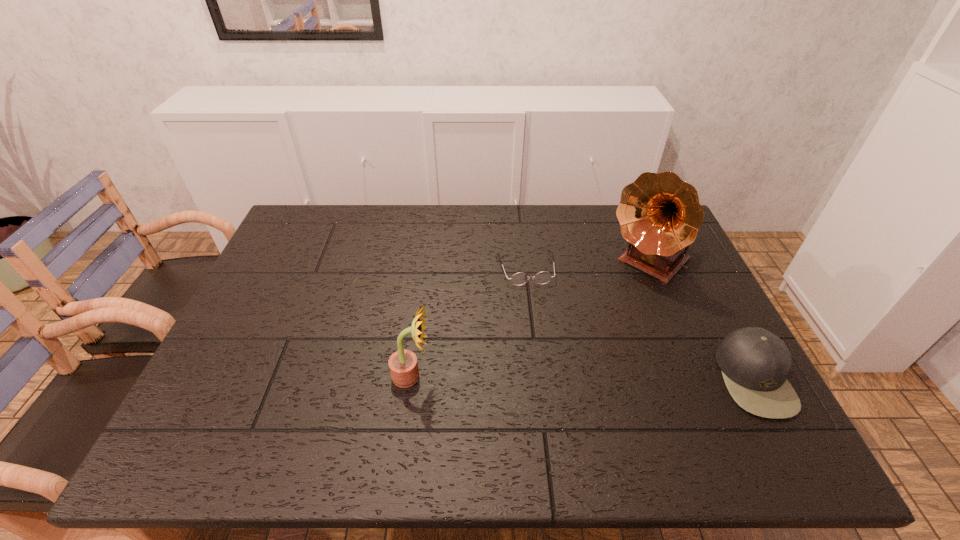
I want to click on free space located on the horn of the phonograph_record, so click(569, 345).

Find the location of a particular element. The image size is (960, 540). vacant space positioned 0.370m on the horn of the phonograph_record is located at coordinates (551, 363).

I want to click on vacant space located 0.300m on the horn of the phonograph_record, so click(567, 347).

Where is `free region located through the lenses of the spectacles`? This screenshot has height=540, width=960. free region located through the lenses of the spectacles is located at coordinates (544, 353).

Locate an element on the screen. free space located 0.240m through the lenses of the spectacles is located at coordinates (544, 353).

Find the location of `blank area located through the lenses of the spectacles`. blank area located through the lenses of the spectacles is located at coordinates (556, 402).

The width and height of the screenshot is (960, 540). I want to click on object at the far edge, so click(x=660, y=215).

I want to click on sunflower that is positioned at the near edge, so click(403, 365).

This screenshot has width=960, height=540. What are the coordinates of `cap that is at the near edge` in the screenshot? It's located at (754, 362).

This screenshot has width=960, height=540. What are the coordinates of `cap situated at the right edge` in the screenshot? It's located at (754, 362).